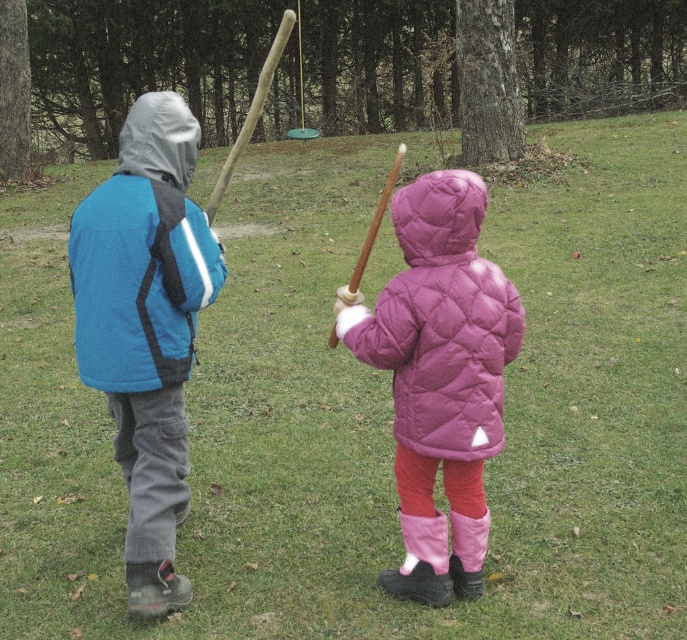
Can you confirm if purple quilted jacket at center is smaller than wooden baseball bat at upper center?

Yes, purple quilted jacket at center is smaller than wooden baseball bat at upper center.

Which is in front, point (484, 192) or point (281, 26)?

Point (484, 192) is in front.

You are a GUI agent. You are given a task and a screenshot of the screen. Output one action in this format:
    pyautogui.click(x=<x>, y=<y>)
    Task: Click on the purple quilted jacket at center
    The width and height of the screenshot is (687, 640).
    Given the screenshot: What is the action you would take?
    pyautogui.click(x=440, y=323)

Consider the image. Is the position of wooden baseball bat at upper center more distant than that of wooden bat at center?

Yes, wooden baseball bat at upper center is behind wooden bat at center.

Who is more forward, (258,104) or (349,294)?

Point (349,294)

Find the location of a particular element. wooden baseball bat at upper center is located at coordinates (251, 112).

Can you confirm if blue fleece jacket at left is bigger than wooden bat at center?

Incorrect, blue fleece jacket at left is not larger than wooden bat at center.

Between point (172, 419) and point (401, 154), which one is positioned behind?

Positioned behind is point (401, 154).

The height and width of the screenshot is (640, 687). I want to click on blue fleece jacket at left, so click(x=146, y=326).